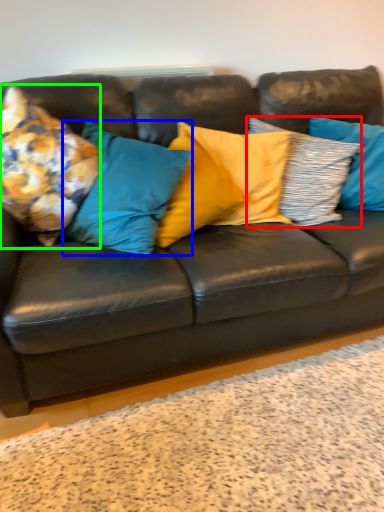
Question: Which object is the closest to the pillow (highlighted by a red box)? Choose among these: pillow (highlighted by a blue box) or pillow (highlighted by a green box).

Choices:
 (A) pillow
 (B) pillow

Answer: (A)